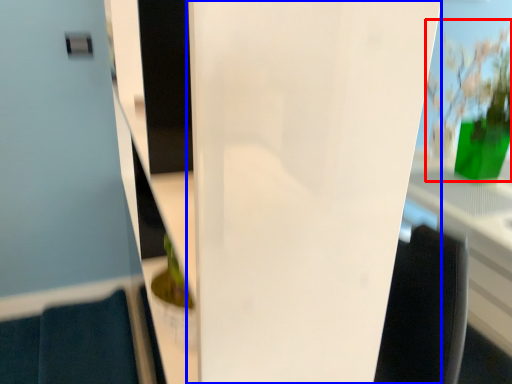
Question: Which point is further to the camera, floral arrangement (highlighted by a red box) or glass door (highlighted by a blue box)?

Choices:
 (A) floral arrangement
 (B) glass door

Answer: (A)